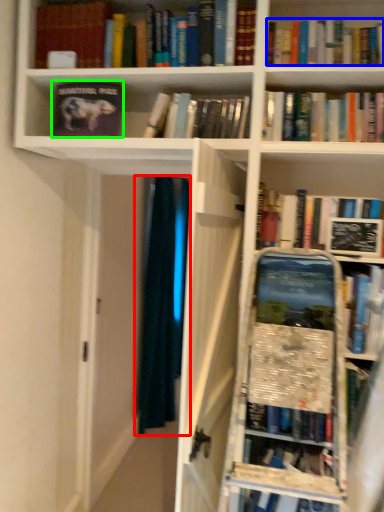
Question: Which is farther away from curtain (highlighted by a red box)? book (highlighted by a blue box) or book (highlighted by a green box)?

Choices:
 (A) book
 (B) book

Answer: (A)